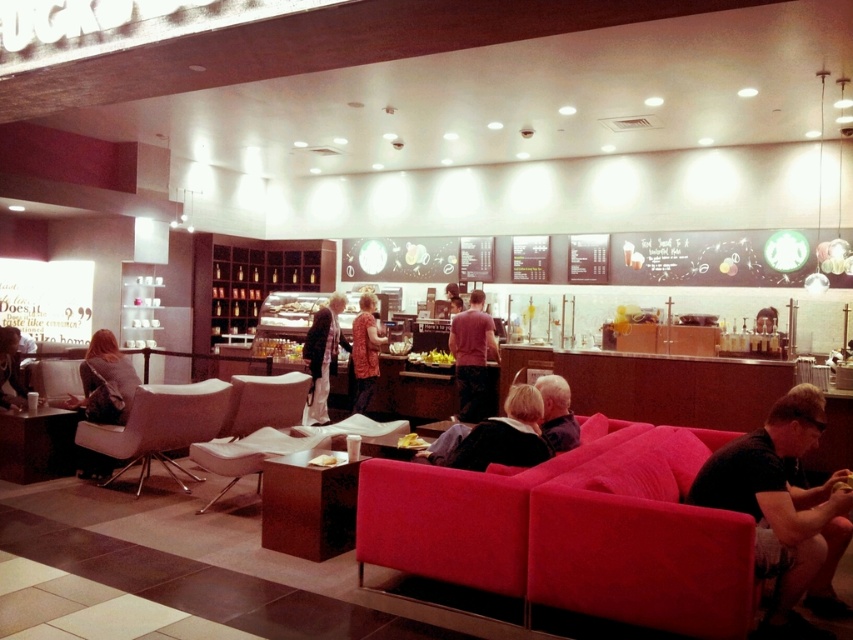
You are a customer in the cafe and want to grab the golden crispy pastry at center without disturbing the matte pink shirt at center. Can you reach it easily?

The matte pink shirt at center is much taller than the golden crispy pastry at center, so it might block your view or access to the pastry. You may need to move around or ask someone to move the shirt temporarily.

You are navigating through the modern cafe and need to reach a specific location. You are currently at point (x=322, y=465). There is another point at (x=473, y=296). Which direction should you move to get closer to the second point?

To move closer to point (x=473, y=296) from your current position at point (x=322, y=465), you should move in the direction towards it. Since point (x=473, y=296) is behind point (x=322, y=465), you would need to move backward relative to your current position to reach it.

You are a customer in the modern cafe and want to grab the yellow matte sandwich at center. However, there is a person wearing a matte pink shirt at center sitting in your way. Can you reach the sandwich without moving the person?

The matte pink shirt at center is much taller than the yellow matte sandwich at center, so the person wearing the matte pink shirt at center is taller than the sandwich. Therefore, you might not be able to reach the sandwich without moving the person since the person is taller and blocking the path.